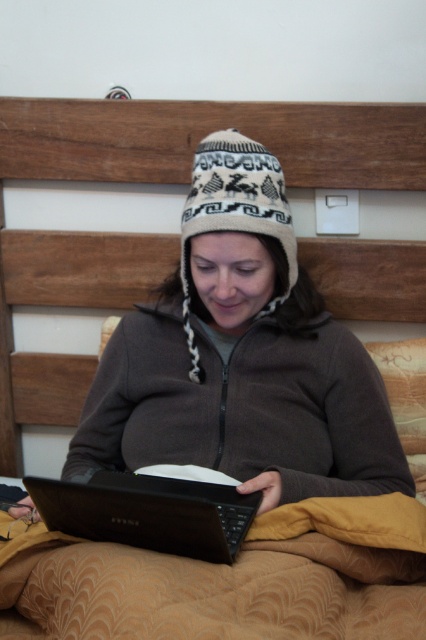
You are designing a storage box that needs to accommodate both the black matte laptop at center and the white knitted hat at center. Based on their sizes, which object requires a taller compartment?

The white knitted hat at center requires a taller compartment because the black matte laptop at center is not as tall as the white knitted hat at center.

You are a delivery robot with a package that needs to be placed on the bed. The package is 18 inches long. You see the black matte laptop at center and the white knitted hat at center. Can you fit the package between them without moving either object?

The distance between the black matte laptop at center and the white knitted hat at center is 17.12 inches. Since the package is 18 inches long, it cannot fit between them without moving either object.